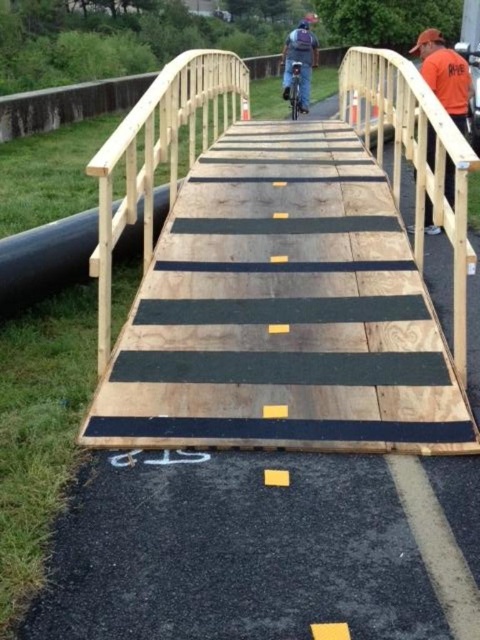
Question: Can you confirm if orange cotton shirt at upper right is wider than denim jacket at center?

Choices:
 (A) yes
 (B) no

Answer: (A)

Question: Which object is closer to the camera taking this photo?

Choices:
 (A) denim jacket at center
 (B) wooden bridge at center

Answer: (B)

Question: Which point is closer to the camera?

Choices:
 (A) (459, 58)
 (B) (311, 172)
 (C) (308, 35)

Answer: (B)

Question: Is orange cotton shirt at upper right behind denim jacket at center?

Choices:
 (A) no
 (B) yes

Answer: (A)

Question: Which object is closer to the camera taking this photo?

Choices:
 (A) orange cotton shirt at upper right
 (B) denim jacket at center

Answer: (A)

Question: Can you confirm if wooden bridge at center is wider than denim jacket at center?

Choices:
 (A) yes
 (B) no

Answer: (A)